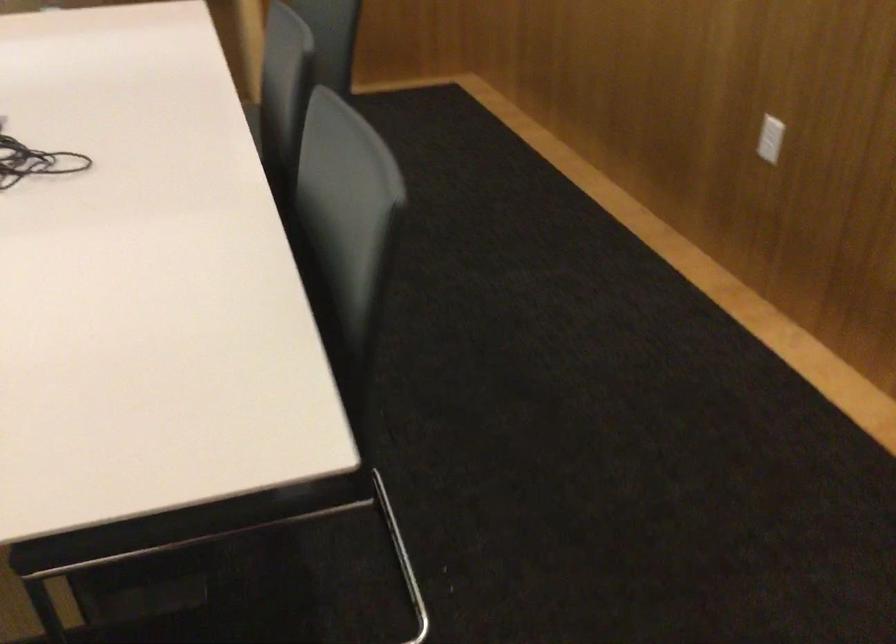
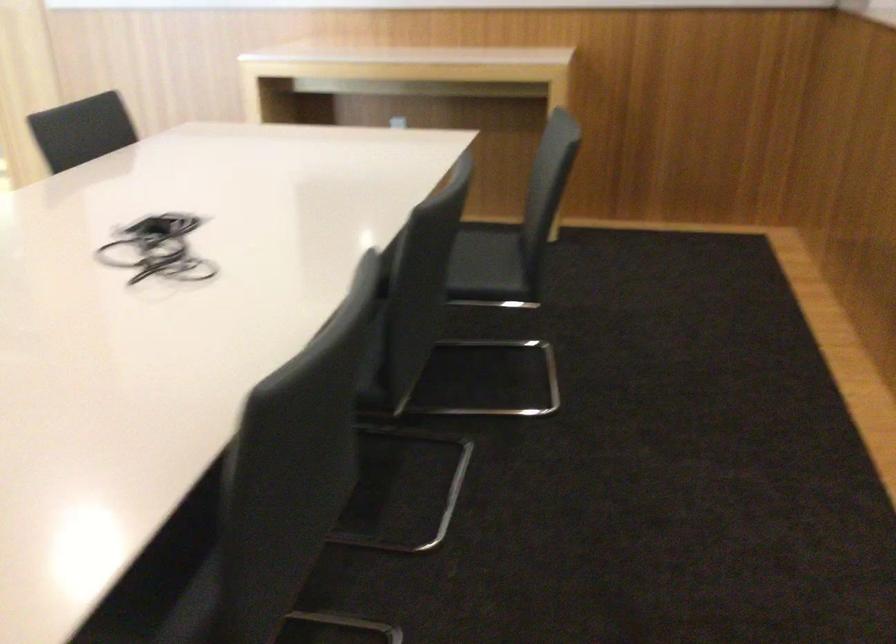
The images are taken continuously from a first-person perspective. In which direction are you moving?

The movement direction of the cameraman is right, forward.